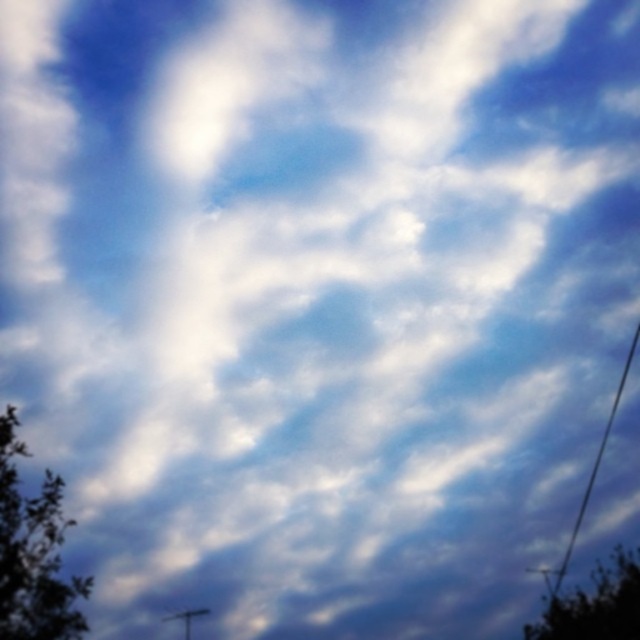
Who is taller, green leafy tree at lower left or green leafy tree at lower right?

Standing taller between the two is green leafy tree at lower left.

Identify the location of green leafy tree at lower left. Image resolution: width=640 pixels, height=640 pixels. (33, 554).

You are a GUI agent. You are given a task and a screenshot of the screen. Output one action in this format:
    pyautogui.click(x=<x>, y=<y>)
    Task: Click on the green leafy tree at lower left
    This screenshot has height=640, width=640.
    Given the screenshot: What is the action you would take?
    pyautogui.click(x=33, y=554)